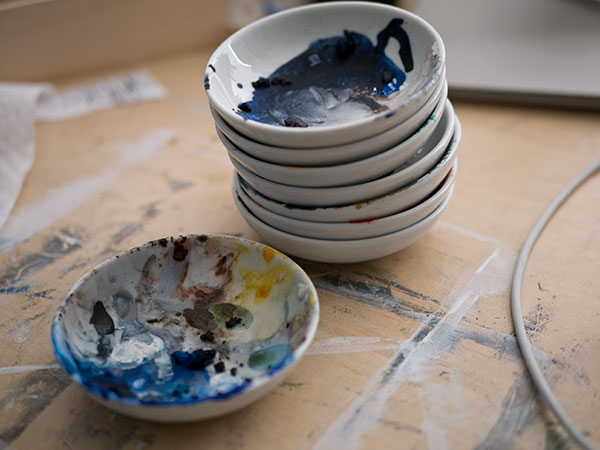
The image size is (600, 450). Identify the location of white cord. (517, 314).